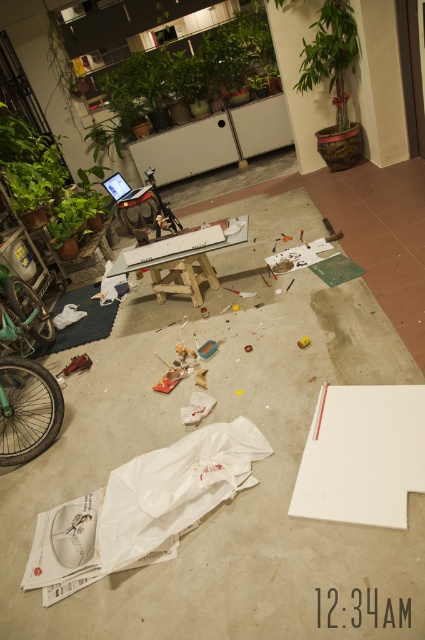
Is wooden table at center wider than matte black laptop at center?

Correct, the width of wooden table at center exceeds that of matte black laptop at center.

Who is taller, wooden table at center or matte black laptop at center?

wooden table at center is taller.

Between point (192, 288) and point (122, 195), which one is positioned in front?

Point (192, 288) is in front.

Where is `wooden table at center`? wooden table at center is located at coordinates (183, 268).

Does point (303, 410) lie behind point (218, 58)?

No, (303, 410) is closer to viewer.

Looking at this image, does white matte cement at center have a lesser height compared to green leafy plant at upper center?

In fact, white matte cement at center may be taller than green leafy plant at upper center.

Is point (99, 276) closer to camera compared to point (195, 58)?

Yes, it is in front of point (195, 58).

Locate an element on the screen. This screenshot has width=425, height=640. white matte cement at center is located at coordinates (237, 493).

How distant is green leafy plant at upper center from green leafy plant at upper left?

The distance of green leafy plant at upper center from green leafy plant at upper left is 2.02 meters.

Is green leafy plant at upper center taller than green leafy plant at upper left?

Correct, green leafy plant at upper center is much taller as green leafy plant at upper left.

Between point (107, 76) and point (71, 224), which one is positioned in front?

Point (71, 224) is more forward.

The image size is (425, 640). I want to click on green leafy plant at upper center, so click(189, 72).